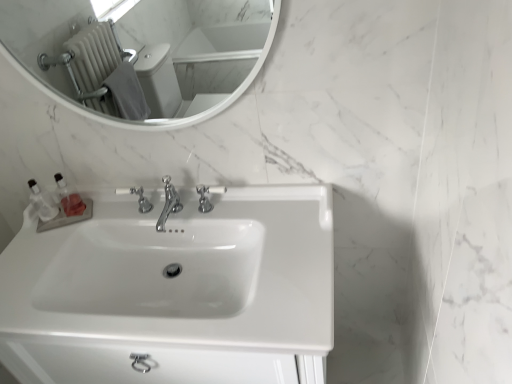
This screenshot has height=384, width=512. Find the location of `space that is in front of clear plastic bottles at left, which is the second toiletry in right-to-left order`. space that is in front of clear plastic bottles at left, which is the second toiletry in right-to-left order is located at coordinates (33, 252).